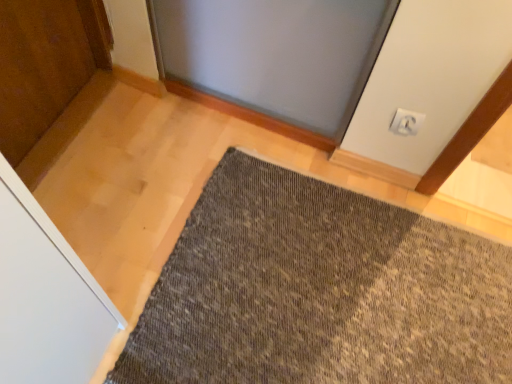
Question: In terms of size, does white plastic electric outlet at upper right appear bigger or smaller than textured gray mat at center?

Choices:
 (A) small
 (B) big

Answer: (A)

Question: In terms of width, does white plastic electric outlet at upper right look wider or thinner when compared to textured gray mat at center?

Choices:
 (A) wide
 (B) thin

Answer: (B)

Question: From a real-world perspective, is white plastic electric outlet at upper right positioned above or below textured gray mat at center?

Choices:
 (A) above
 (B) below

Answer: (A)

Question: Considering the positions of textured gray mat at center and white plastic electric outlet at upper right in the image, is textured gray mat at center bigger or smaller than white plastic electric outlet at upper right?

Choices:
 (A) small
 (B) big

Answer: (B)

Question: In the image, is textured gray mat at center positioned in front of or behind white plastic electric outlet at upper right?

Choices:
 (A) front
 (B) behind

Answer: (A)

Question: Based on their positions, is textured gray mat at center located to the left or right of white plastic electric outlet at upper right?

Choices:
 (A) left
 (B) right

Answer: (A)

Question: Is textured gray mat at center inside the boundaries of white plastic electric outlet at upper right, or outside?

Choices:
 (A) outside
 (B) inside

Answer: (A)